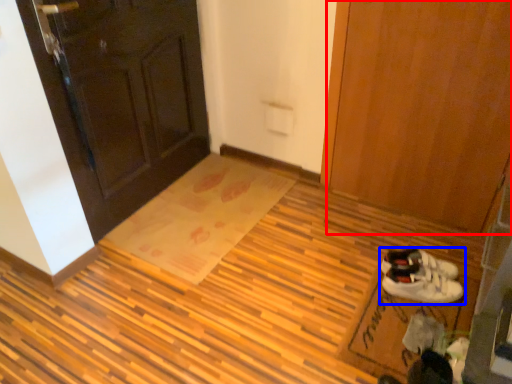
Question: Which object appears farthest to the camera in this image, door (highlighted by a red box) or footwear (highlighted by a blue box)?

Choices:
 (A) door
 (B) footwear

Answer: (B)